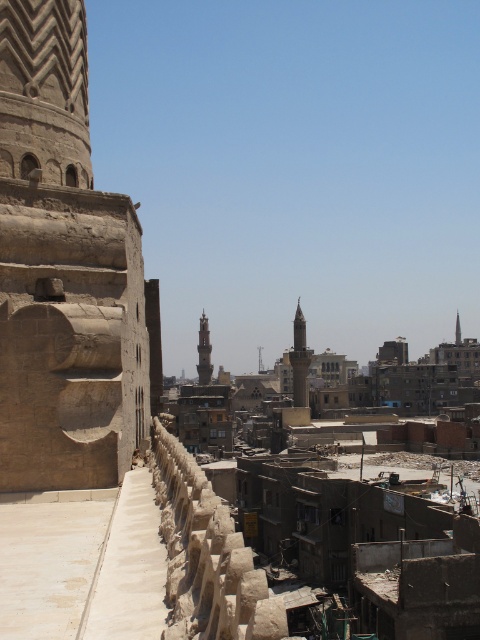
Question: Is brown stone tower at center to the left of smooth stone minaret at center from the viewer's perspective?

Choices:
 (A) no
 (B) yes

Answer: (B)

Question: Among these objects, which one is nearest to the camera?

Choices:
 (A) light brown stone minaret at center
 (B) brown stone tower at center

Answer: (A)

Question: Does brown stone tower at center appear on the right side of smooth stone minaret at center?

Choices:
 (A) no
 (B) yes

Answer: (A)

Question: Which point appears farthest from the camera in this image?

Choices:
 (A) (456, 326)
 (B) (201, 358)
 (C) (307, 353)

Answer: (A)

Question: Does light brown stone minaret at center come in front of brown stone tower at center?

Choices:
 (A) yes
 (B) no

Answer: (A)

Question: Which point appears closest to the camera in this image?

Choices:
 (A) (457, 323)
 (B) (300, 400)
 (C) (206, 353)

Answer: (B)